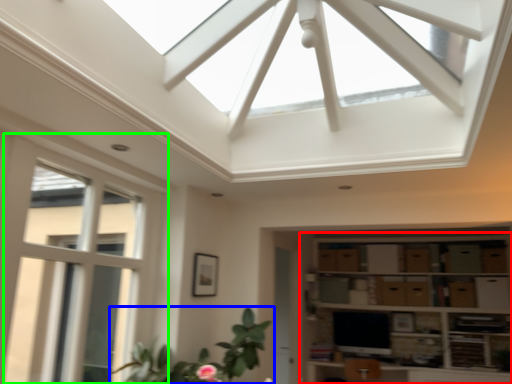
Question: Which object is positioned farthest from shelf (highlighted by a red box)? Select from houseplant (highlighted by a blue box) and window (highlighted by a green box).

Choices:
 (A) houseplant
 (B) window

Answer: (B)